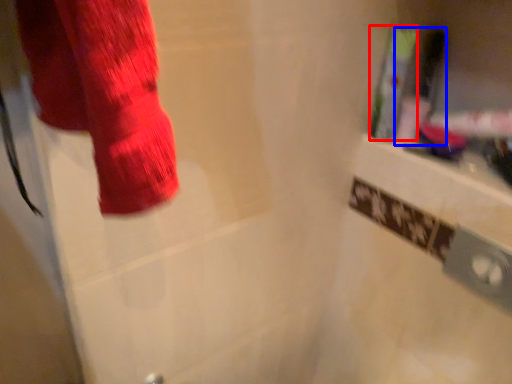
Question: Which of the following is the farthest to the observer, toiletry (highlighted by a red box) or toiletry (highlighted by a blue box)?

Choices:
 (A) toiletry
 (B) toiletry

Answer: (B)